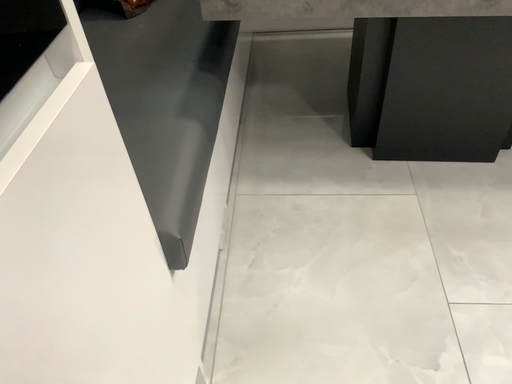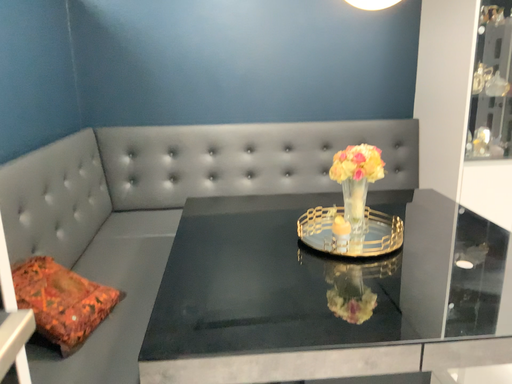
Question: Which way did the camera rotate in the video?

Choices:
 (A) rotated right
 (B) rotated left

Answer: (A)